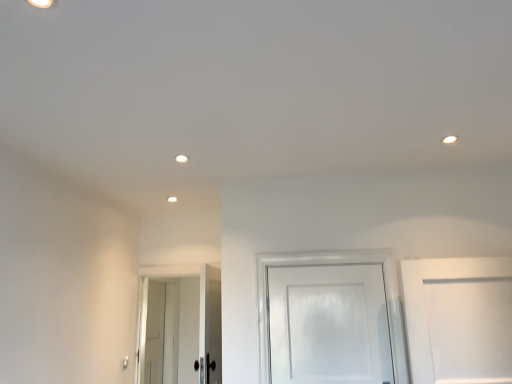
Question: From a real-world perspective, is white glossy door at lower left, the third door when ordered from front to back, over white glossy door at lower left, which appears as the 2th door when viewed from the left?

Choices:
 (A) yes
 (B) no

Answer: (B)

Question: Does white glossy door at lower left, which ranks as the third door in right-to-left order, appear on the left side of white glossy door at lower left, the 2th door in the front-to-back sequence?

Choices:
 (A) no
 (B) yes

Answer: (B)

Question: Could you tell me if white glossy door at lower left, the third door when ordered from front to back, is turned towards white glossy door at lower left, which appears as the 2th door when viewed from the left?

Choices:
 (A) yes
 (B) no

Answer: (B)

Question: From a real-world perspective, is white glossy door at lower left, the 1th door when ordered from left to right, physically below white glossy door at lower left, which appears as the 2th door when viewed from the left?

Choices:
 (A) no
 (B) yes

Answer: (B)

Question: Is white glossy door at lower left, marked as the first door in a back-to-front arrangement, to the right of white glossy door at lower left, the second door from the back, from the viewer's perspective?

Choices:
 (A) no
 (B) yes

Answer: (A)

Question: Does white glossy door at lower left, the 1th door when ordered from left to right, have a larger size compared to white glossy door at lower left, the 2th door in the front-to-back sequence?

Choices:
 (A) no
 (B) yes

Answer: (A)

Question: From a real-world perspective, is white glossy door at lower left, the 1th door when ordered from left to right, under white glossy door at center, the first door viewed from the right?

Choices:
 (A) yes
 (B) no

Answer: (A)

Question: Is white glossy door at lower left, which ranks as the third door in right-to-left order, not close to white glossy door at center, the 3th door positioned from the left?

Choices:
 (A) yes
 (B) no

Answer: (A)

Question: Does white glossy door at lower left, the third door when ordered from front to back, have a smaller size compared to white glossy door at center, arranged as the 3th door when viewed from the back?

Choices:
 (A) yes
 (B) no

Answer: (B)

Question: Is white glossy door at lower left, marked as the first door in a back-to-front arrangement, completely or partially outside of white glossy door at center, the 3th door positioned from the left?

Choices:
 (A) no
 (B) yes

Answer: (B)

Question: Is white glossy door at lower left, the 1th door when ordered from left to right, taller than white glossy door at center, which appears as the 1th door when viewed from the front?

Choices:
 (A) no
 (B) yes

Answer: (B)

Question: Considering the relative positions of white glossy door at lower left, the 1th door when ordered from left to right, and white glossy door at center, which appears as the 1th door when viewed from the front, in the image provided, is white glossy door at lower left, the 1th door when ordered from left to right, to the left of white glossy door at center, which appears as the 1th door when viewed from the front, from the viewer's perspective?

Choices:
 (A) yes
 (B) no

Answer: (A)

Question: Is white glossy door at lower left, arranged as the second door when viewed from the right, not close to white glossy door at lower left, which ranks as the third door in right-to-left order?

Choices:
 (A) no
 (B) yes

Answer: (A)